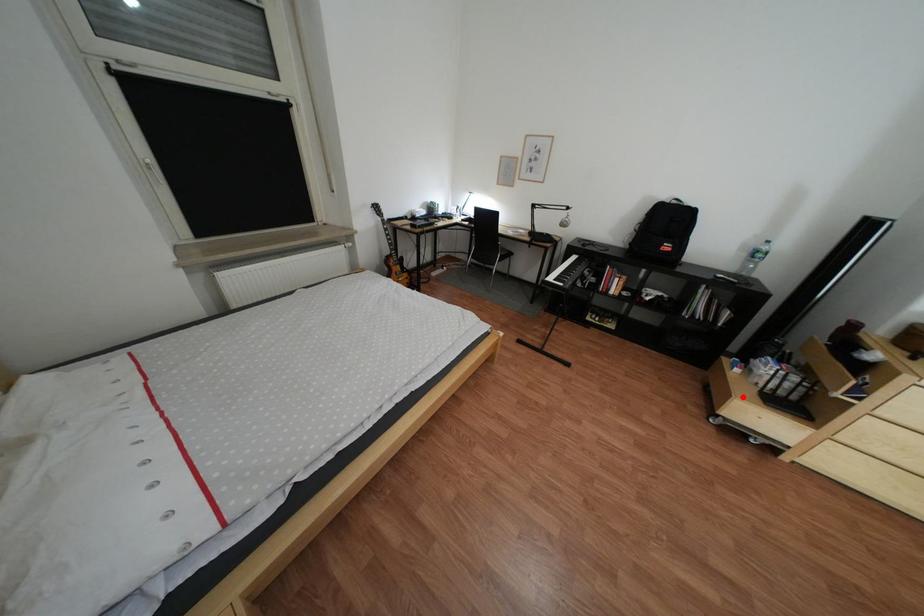
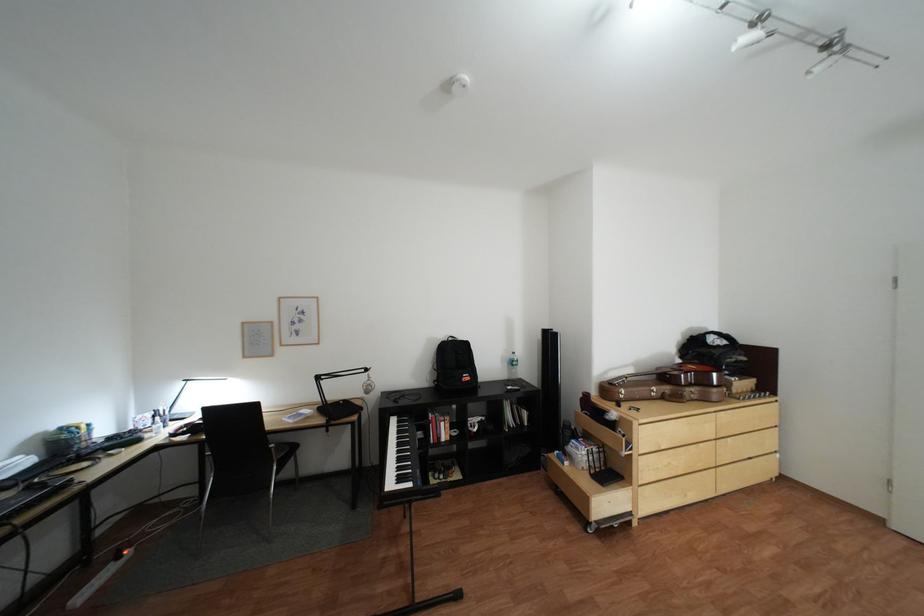
The point at the highlighted location is marked in the first image. Where is the corresponding point in the second image?

(602, 500)